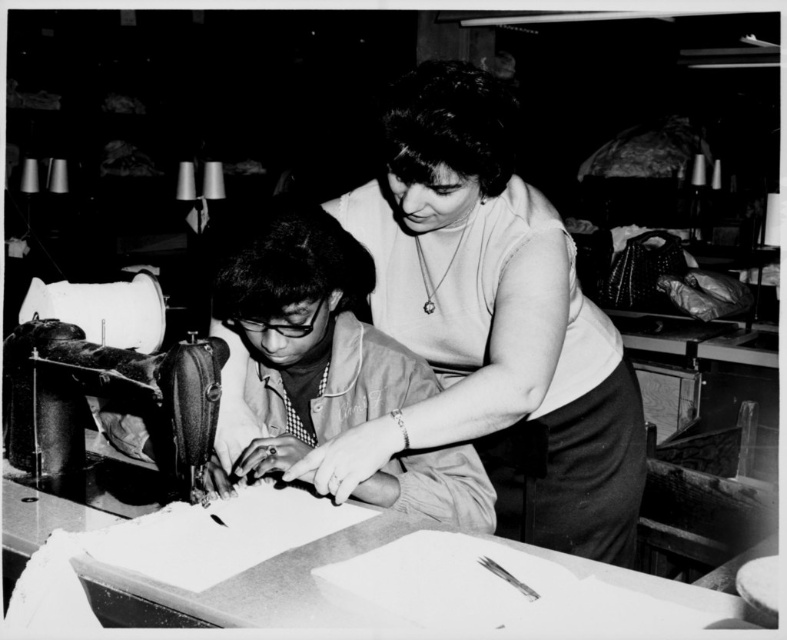
Can you confirm if smooth white blouse at center is shorter than smooth beige shirt at center?

No.

Can you confirm if smooth white blouse at center is positioned above smooth beige shirt at center?

A: Indeed, smooth white blouse at center is positioned over smooth beige shirt at center.

This screenshot has width=787, height=640. What do you see at coordinates (490, 320) in the screenshot?
I see `smooth white blouse at center` at bounding box center [490, 320].

Where is `smooth white blouse at center`? The image size is (787, 640). smooth white blouse at center is located at coordinates (490, 320).

Is smooth white blouse at center closer to the viewer compared to metallic sewing machine at left?

Yes, it is in front of metallic sewing machine at left.

Is point (514, 396) closer to camera compared to point (17, 403)?

Yes, point (514, 396) is closer to viewer.

Identify the location of smooth white blouse at center. (490, 320).

Can you confirm if smooth beige shirt at center is positioned to the right of metallic sewing machine at left?

Correct, you'll find smooth beige shirt at center to the right of metallic sewing machine at left.

Does smooth beige shirt at center have a lesser height compared to metallic sewing machine at left?

Incorrect, smooth beige shirt at center's height does not fall short of metallic sewing machine at left's.

The image size is (787, 640). Identify the location of smooth beige shirt at center. (309, 337).

Where is `smooth beige shirt at center`? The height and width of the screenshot is (640, 787). smooth beige shirt at center is located at coordinates (309, 337).